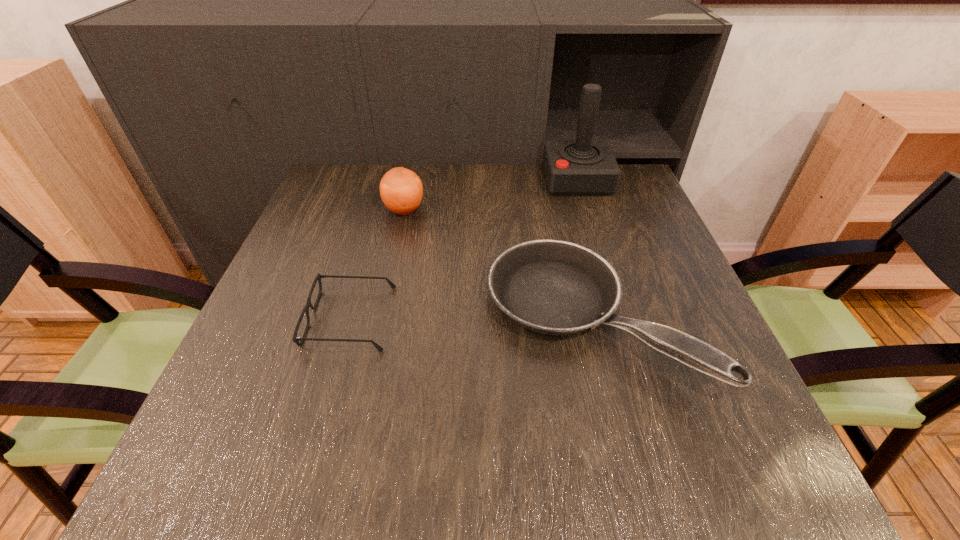
Where is `vacant space that is in between the tallest object and the spectacles`? Image resolution: width=960 pixels, height=540 pixels. vacant space that is in between the tallest object and the spectacles is located at coordinates (464, 249).

Locate an element on the screen. the closest object to the joystick is located at coordinates (554, 287).

Find the location of a particular element. Image resolution: width=960 pixels, height=540 pixels. object that is the third nearest to the orange is located at coordinates (583, 167).

At what (x,y) coordinates should I click in order to perform the action: click on free spot that satisfies the following two spatial constraints: 1. on the front-facing side of the spectacles; 2. on the left side of the third nearest object. Please return your answer as a coordinate pair (x, y). The image size is (960, 540). Looking at the image, I should click on [381, 210].

Image resolution: width=960 pixels, height=540 pixels. Identify the location of vacant space that satisfies the following two spatial constraints: 1. on the front-facing side of the third shortest object; 2. on the left side of the shortest object. (381, 210).

Identify the location of vacant space that satisfies the following two spatial constraints: 1. on the base of the farthest object; 2. on the front side of the frying pan. (620, 320).

This screenshot has height=540, width=960. I want to click on vacant area in the image that satisfies the following two spatial constraints: 1. on the front-facing side of the shortest object; 2. on the right side of the orange, so click(381, 210).

At what (x,y) coordinates should I click in order to perform the action: click on blank space that satisfies the following two spatial constraints: 1. on the base of the farthest object; 2. on the front side of the third tallest object. Please return your answer as a coordinate pair (x, y). Looking at the image, I should click on (620, 320).